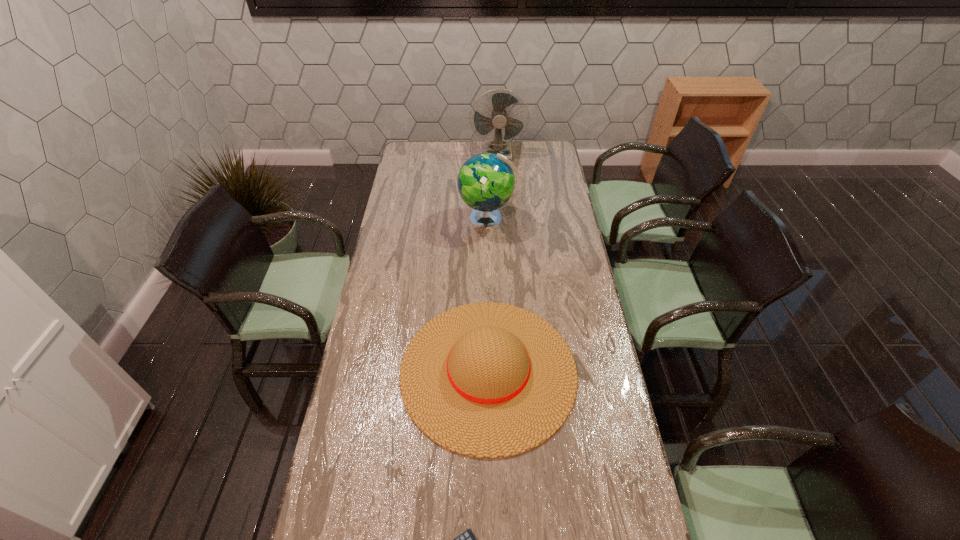
Where is `object at the left edge`? object at the left edge is located at coordinates (488, 380).

Locate an element on the screen. The width and height of the screenshot is (960, 540). object situated at the right edge is located at coordinates (488, 380).

This screenshot has width=960, height=540. In the image, there is a desktop. Identify the location of free space at the far edge. (439, 156).

At what (x,y) coordinates should I click in order to perform the action: click on free space at the left edge of the desktop. Please return your answer as a coordinate pair (x, y). Image resolution: width=960 pixels, height=540 pixels. Looking at the image, I should click on (371, 355).

In the image, there is a desktop. Where is `free space at the right edge`? free space at the right edge is located at coordinates (579, 321).

Locate an element on the screen. vacant space at the far left corner of the desktop is located at coordinates (407, 150).

At what (x,y) coordinates should I click in order to perform the action: click on vacant space at the far right corner of the desktop. Please return your answer as a coordinate pair (x, y). Looking at the image, I should click on (x=539, y=161).

Where is `free space between the bonnet and the third nearest object`? This screenshot has height=540, width=960. free space between the bonnet and the third nearest object is located at coordinates (489, 295).

Locate which object is the second closest to the shortest object. Please provide its 2D coordinates. Your answer should be formatted as a tuple, i.e. [(x, y)], where the tuple contains the x and y coordinates of a point satisfying the conditions above.

[(486, 182)]

Select which object is the closest to the fan. Please provide its 2D coordinates. Your answer should be formatted as a tuple, i.e. [(x, y)], where the tuple contains the x and y coordinates of a point satisfying the conditions above.

[(486, 182)]